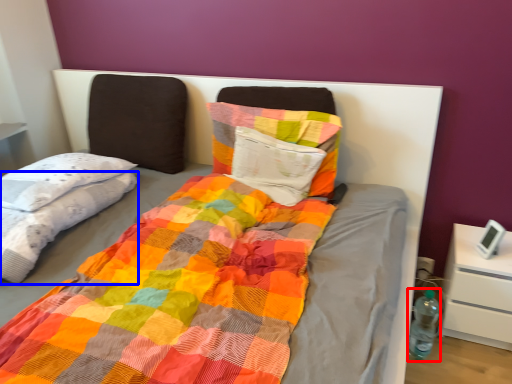
Question: Which point is closer to the camera, bottle (highlighted by a red box) or blanket (highlighted by a blue box)?

Choices:
 (A) bottle
 (B) blanket

Answer: (B)